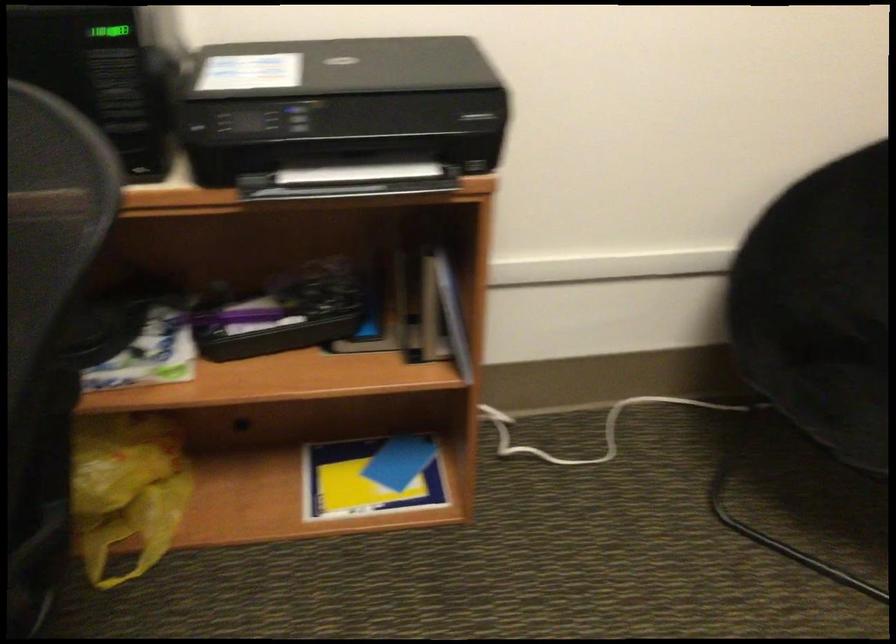
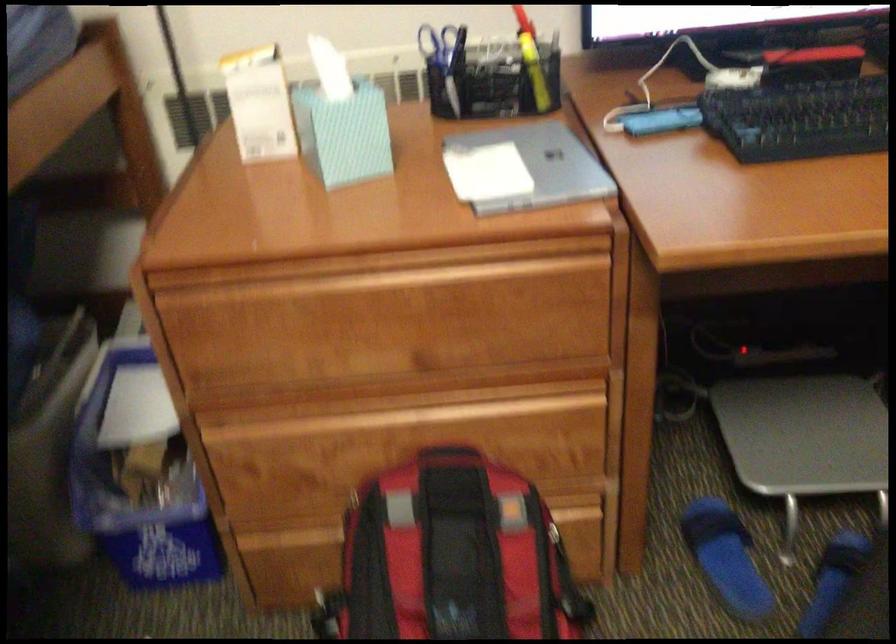
First-person continuous shooting, in which direction is the camera rotating?

The camera's rotation is toward left-down.